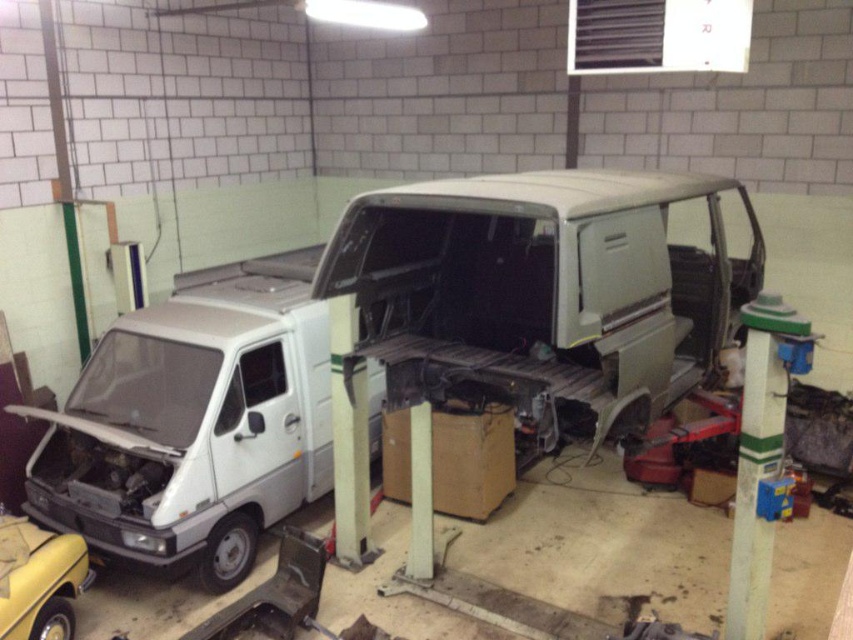
Question: Can you confirm if white matte van at left is thinner than yellow matte car at lower left?

Choices:
 (A) yes
 (B) no

Answer: (B)

Question: Does white matte van at left appear on the left side of yellow matte car at lower left?

Choices:
 (A) no
 (B) yes

Answer: (A)

Question: Which point is closer to the camera?

Choices:
 (A) (44, 600)
 (B) (291, 387)

Answer: (A)

Question: Does white matte van at left have a lesser width compared to yellow matte car at lower left?

Choices:
 (A) no
 (B) yes

Answer: (A)

Question: Among these objects, which one is nearest to the camera?

Choices:
 (A) white matte van at left
 (B) yellow matte car at lower left

Answer: (B)